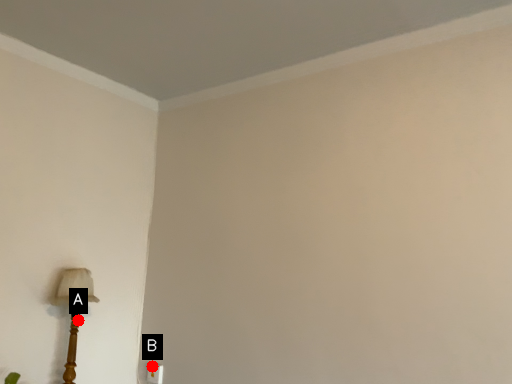
Question: Two points are circled on the image, labeled by A and B beside each circle. Which point appears farthest from the camera in this image?

Choices:
 (A) A is further
 (B) B is further

Answer: (B)